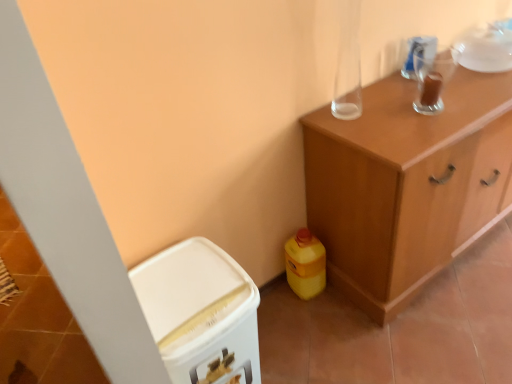
Where is `blank space above white plastic bin at lower left, which appears as the second cabinetry when viewed from the right (from a real-world perspective)`? The height and width of the screenshot is (384, 512). blank space above white plastic bin at lower left, which appears as the second cabinetry when viewed from the right (from a real-world perspective) is located at coordinates (176, 287).